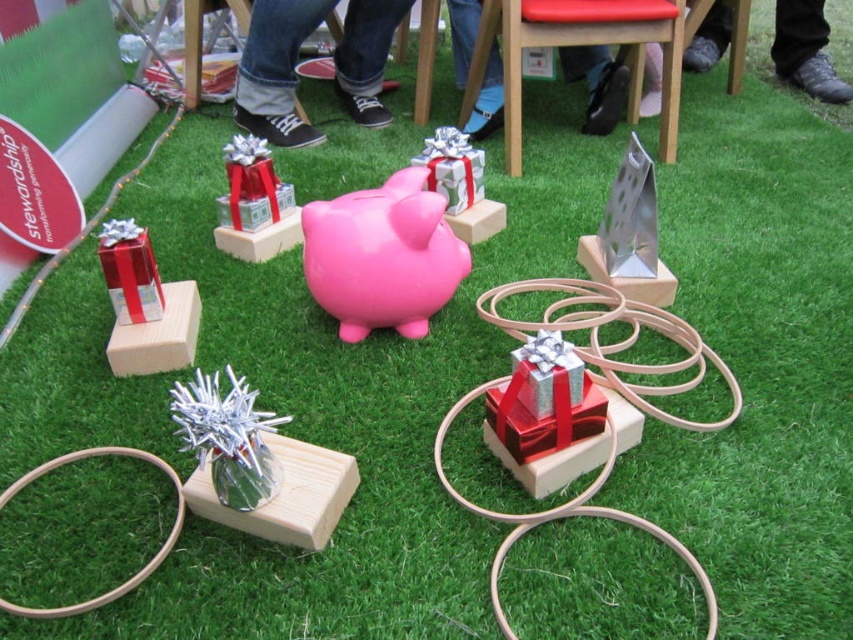
Between point (485, 17) and point (229, 492), which one is positioned behind?

The point (485, 17) is more distant.

Does metallic silver chair at upper right lie behind silver metallic tinsel at center?

Yes, metallic silver chair at upper right is further from the viewer.

Is point (577, 28) positioned after point (212, 390)?

Yes, it is.

At what (x,y) coordinates should I click in order to perform the action: click on metallic silver chair at upper right. Please return your answer as a coordinate pair (x, y). Looking at the image, I should click on (589, 44).

Does metallic silver chair at upper right have a smaller size compared to shiny red gift at center?

Actually, metallic silver chair at upper right might be larger than shiny red gift at center.

Locate an element on the screen. The height and width of the screenshot is (640, 853). metallic silver chair at upper right is located at coordinates (589, 44).

Can you confirm if pink matte piggy bank at center is smaller than shiny red gift at left?

No, pink matte piggy bank at center is not smaller than shiny red gift at left.

Between pink matte piggy bank at center and shiny red gift at left, which one has more height?

With more height is pink matte piggy bank at center.

In order to click on pink matte piggy bank at center in this screenshot , I will do `click(381, 257)`.